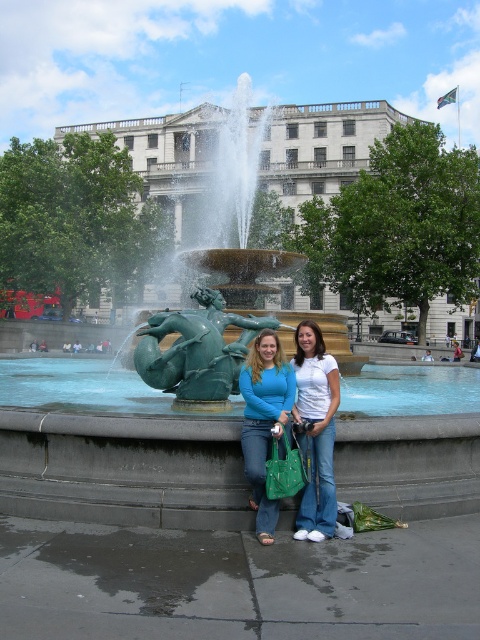
You are a photographer trying to capture both the green patinated metal fountain at center and the green patinated bronze mermaid at center in a single frame. Which object should you focus on first to ensure both are in the shot?

The green patinated metal fountain at center is larger than the green patinated bronze mermaid at center, so you should focus on the fountain first to ensure both fit in the frame.

You are a photographer trying to capture both the green patinated bronze mermaid at center and the white cotton shirt at center in a single frame. Since the mermaid is larger, where should you position your camera to ensure both are clearly visible?

Since the green patinated bronze mermaid at center is larger than the white cotton shirt at center, position the camera closer to the white cotton shirt at center to balance their sizes in the frame.

You are standing at the location of the camera in the scene. The green patinated metal fountain at center is your main subject. To ensure the fountain fills the frame, you need to be within 40 feet. Can you stay at your current position?

The green patinated metal fountain at center and camera are 46.03 feet apart. Since 46.03 feet is more than 40 feet, you need to move closer to the fountain to ensure it fills the frame.